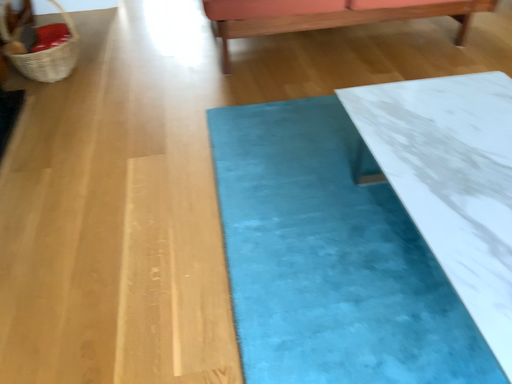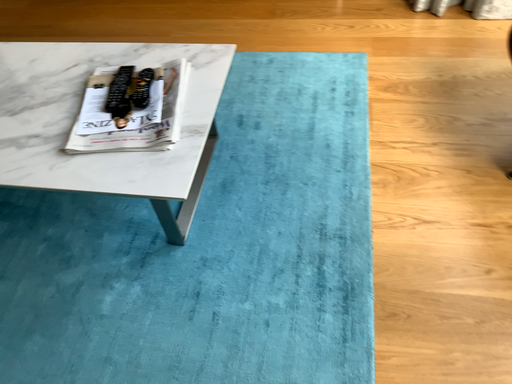
Question: Which way did the camera rotate in the video?

Choices:
 (A) rotated left
 (B) rotated right

Answer: (B)